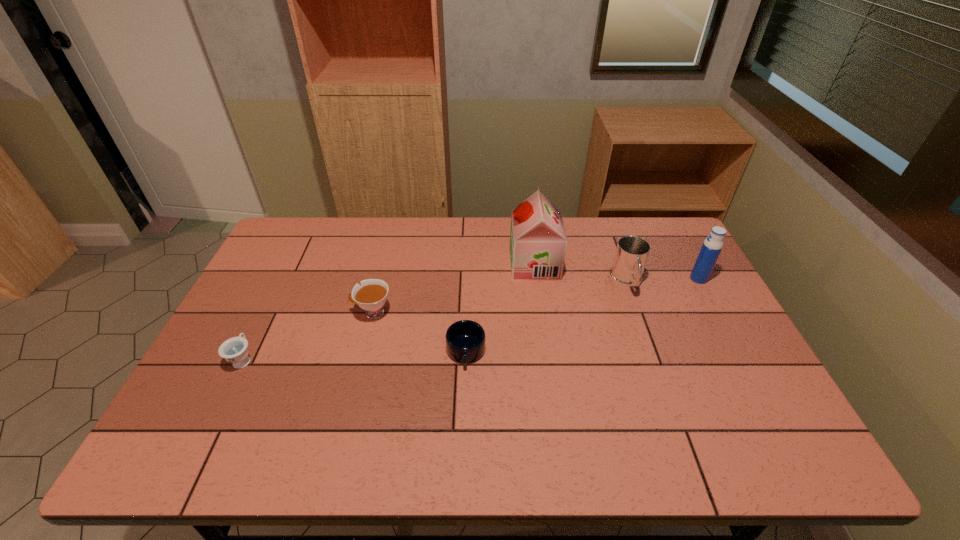
Image resolution: width=960 pixels, height=540 pixels. Find the location of `the nearer mug`. the nearer mug is located at coordinates (465, 340).

You are a GUI agent. You are given a task and a screenshot of the screen. Output one action in this format:
    pyautogui.click(x=<x>, y=<y>)
    Task: Click on the third object from left to right
    Image resolution: width=960 pixels, height=540 pixels.
    Given the screenshot: What is the action you would take?
    pyautogui.click(x=465, y=340)

Find the location of a particular element. The image size is (960, 540). free space located with the cap open on the soya milk is located at coordinates (444, 265).

Image resolution: width=960 pixels, height=540 pixels. Find the location of `vacant space located with the cap open on the soya milk`. vacant space located with the cap open on the soya milk is located at coordinates (471, 265).

The image size is (960, 540). In order to click on vacant space located 0.360m with the cap open on the soya milk in this screenshot , I will do `click(401, 265)`.

This screenshot has width=960, height=540. Identify the location of free space located on the back of the water bottle. (679, 242).

Where is `vacant space located on the side of the farther mug with the handle`? The width and height of the screenshot is (960, 540). vacant space located on the side of the farther mug with the handle is located at coordinates (656, 366).

Identify the location of free space located on the side of the second object from left to right with the handle. The height and width of the screenshot is (540, 960). (318, 313).

I want to click on free space located on the side of the second object from left to right with the handle, so click(x=253, y=313).

Where is `vacant space located 0.140m on the side of the second object from left to right with the handle`? Image resolution: width=960 pixels, height=540 pixels. vacant space located 0.140m on the side of the second object from left to right with the handle is located at coordinates (304, 313).